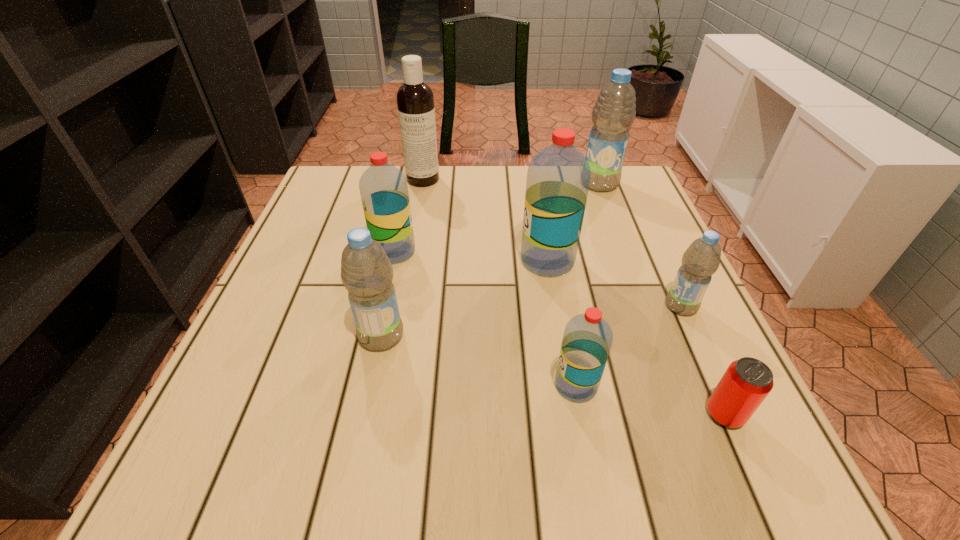
Locate an element on the screen. The image size is (960, 540). free space at the left edge is located at coordinates (317, 241).

Identify the location of vacant space at the right edge. This screenshot has height=540, width=960. (652, 225).

I want to click on free space at the near right corner of the desktop, so click(751, 473).

The image size is (960, 540). What are the coordinates of `free space between the biggest red water bottle and the dishwasher detergent` in the screenshot? It's located at (485, 220).

Where is `vacant point located between the biggest blue water bottle and the dishwasher detergent`? The width and height of the screenshot is (960, 540). vacant point located between the biggest blue water bottle and the dishwasher detergent is located at coordinates (511, 181).

I want to click on vacant area that lies between the farthest water bottle and the second farthest blue water bottle, so click(640, 245).

You are a GUI agent. You are given a task and a screenshot of the screen. Output one action in this format:
    pyautogui.click(x=<x>, y=<y>)
    Task: Click on the unoccupied position between the shortest object and the leftmost red water bottle
    
    Given the screenshot: What is the action you would take?
    pyautogui.click(x=560, y=333)

Image resolution: width=960 pixels, height=540 pixels. Identify the location of free area in between the biggest blue water bottle and the second farthest blue water bottle. (640, 245).

Where is `vacant area that lies between the shortest object and the second smallest red water bottle`? The height and width of the screenshot is (540, 960). vacant area that lies between the shortest object and the second smallest red water bottle is located at coordinates (560, 333).

I want to click on vacant area that lies between the fourth nearest object and the leftmost red water bottle, so click(538, 279).